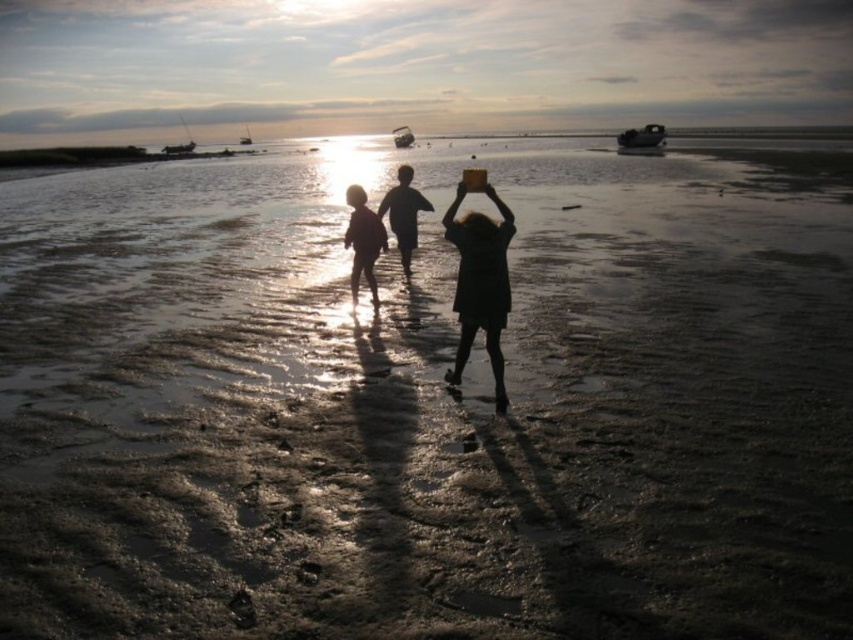
You are standing at the point with coordinates point (x=657, y=124) and want to walk towards the point (x=374, y=296). Which direction should you move?

Point (x=374, y=296) is in front of point (x=657, y=124), so you should move forward towards the direction of point (x=374, y=296).

You are a photographer trying to capture a photo of the metallic gray boat at upper right without any obstructions. However, there is a person wearing a black matte dress at center in the way. Based on their positions, can you still take a clear photo of the boat?

The black matte dress at center is in front of the metallic gray boat at upper right, so it would block the view. You cannot take a clear photo of the metallic gray boat at upper right without moving the black matte dress at center out of the way.

Based on the photo, you are a photographer trying to capture the metallic gray boat at upper right and the black matte dress at center in the same frame. Which object should you position closer to the left side of your camera viewfinder to include both in the shot?

To include both the black matte dress at center and the metallic gray boat at upper right in the same frame, position the black matte dress at center closer to the left side of your camera viewfinder since it is already to the left of the metallic gray boat at upper right.